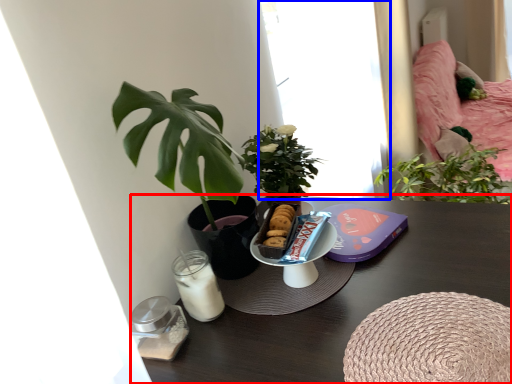
Question: Among these objects, which one is nearest to the camera, table (highlighted by a red box) or window (highlighted by a blue box)?

Choices:
 (A) table
 (B) window

Answer: (A)